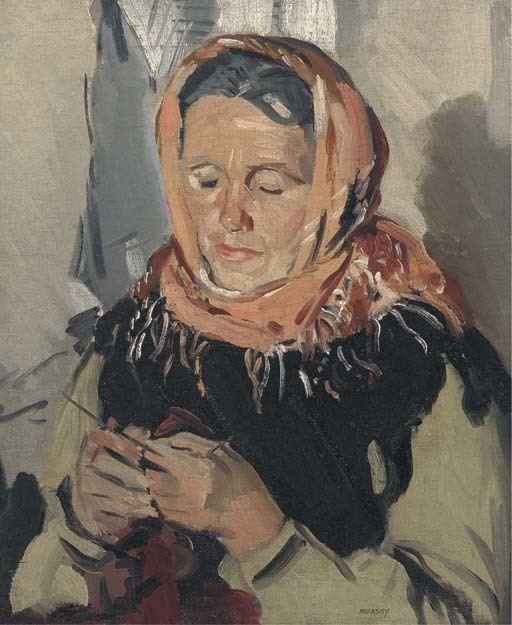
Where is `blanket`? blanket is located at coordinates (176, 570).